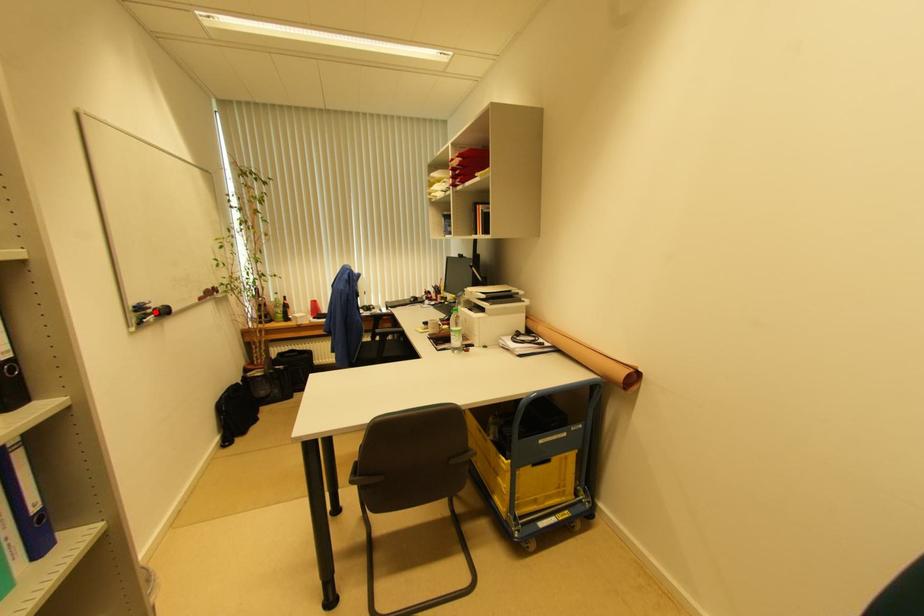
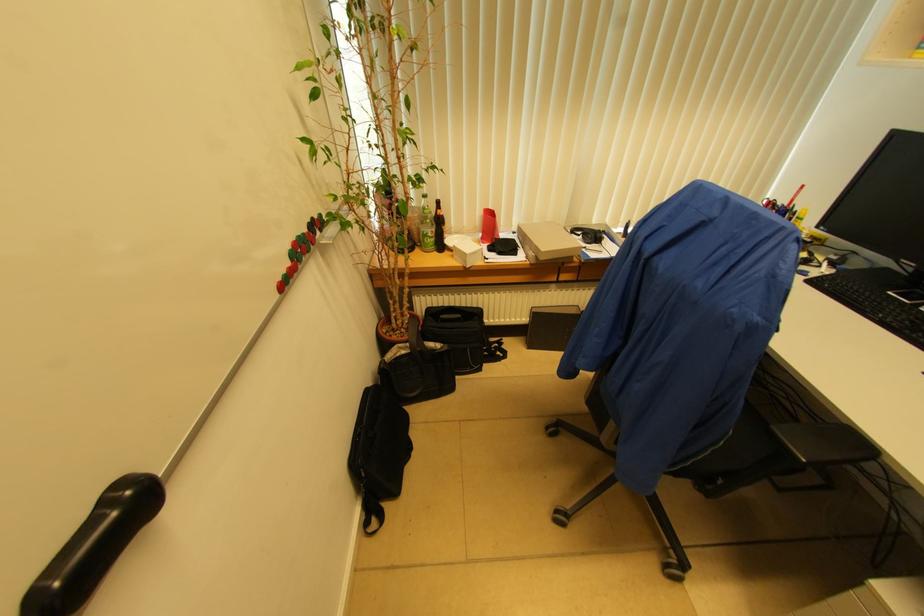
Find the pixel in the second image that matches the highlighted location in the first image.

(35, 600)